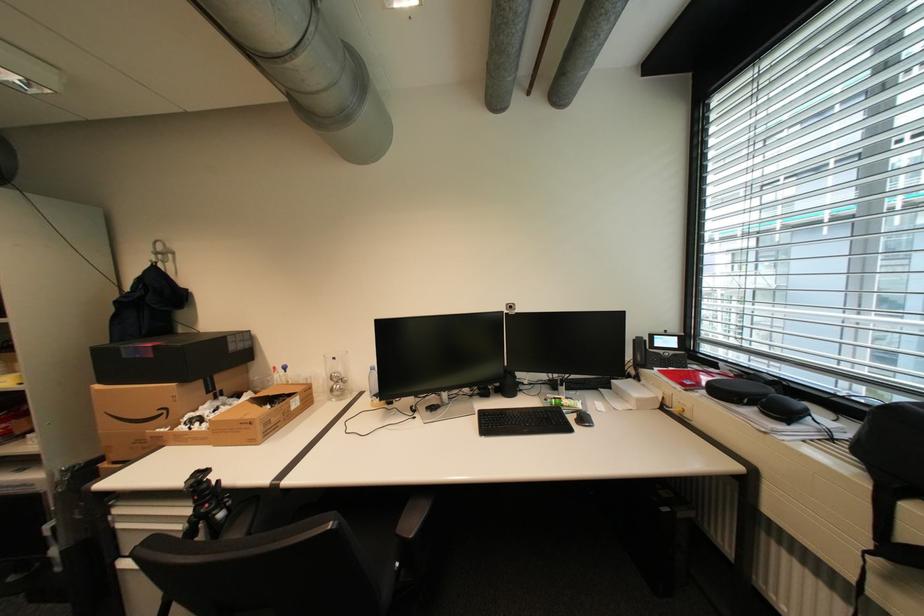
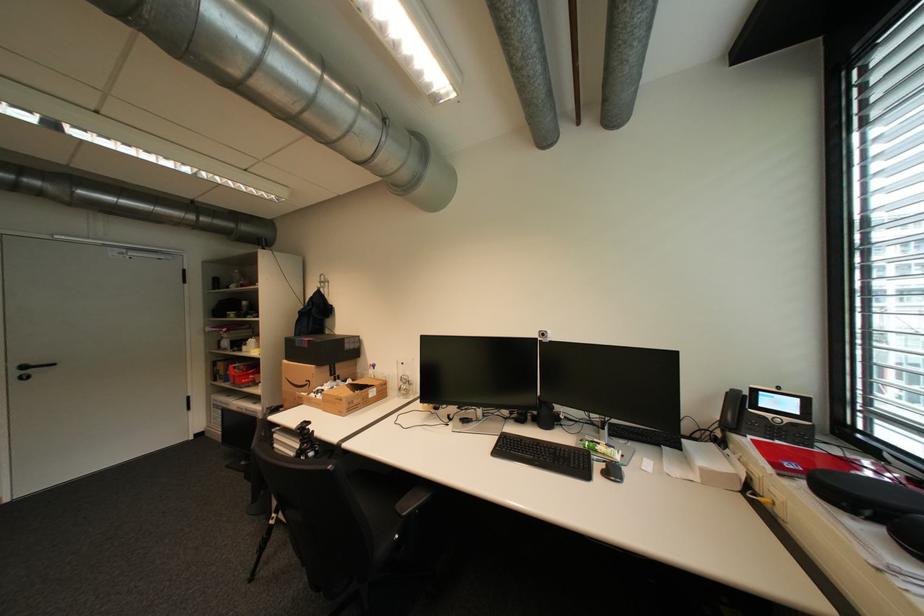
Locate, in the second image, the point that corresponds to pixel 579 419 in the first image.

(606, 467)